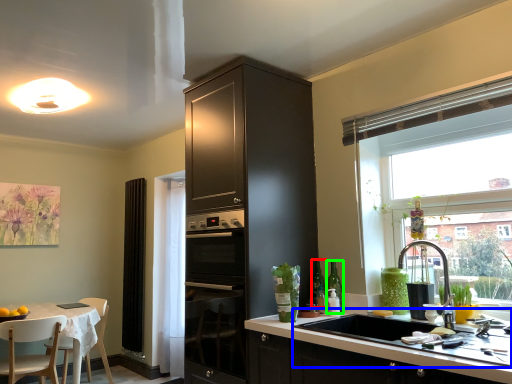
Question: Considering the real-world distances, which object is farthest from bottle (highlighted by a red box)? sink (highlighted by a blue box) or bottle (highlighted by a green box)?

Choices:
 (A) sink
 (B) bottle

Answer: (A)